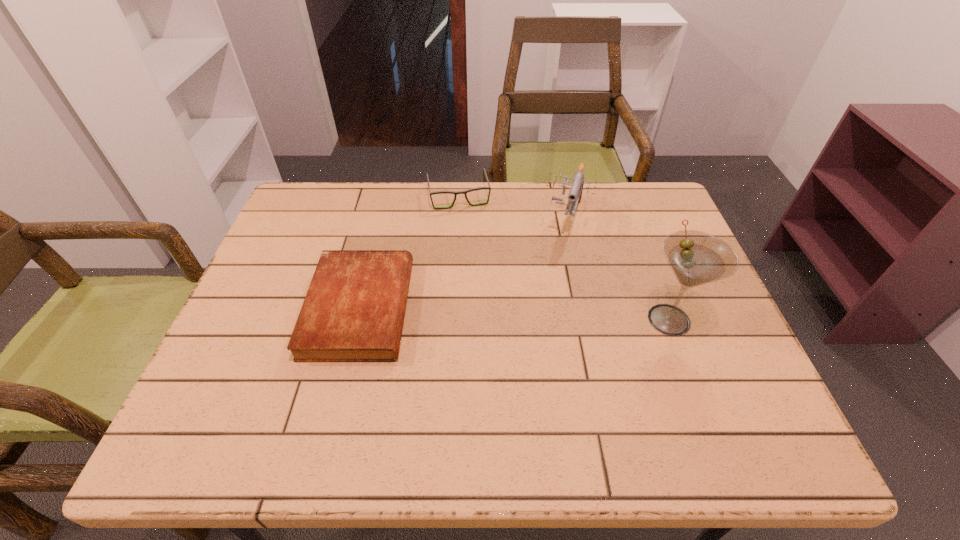
At what (x,y) coordinates should I click in order to perform the action: click on the leftmost object. Please return your answer as a coordinate pair (x, y). This screenshot has height=540, width=960. Looking at the image, I should click on (354, 309).

At what (x,y) coordinates should I click in order to perform the action: click on Bible. Please return your answer as a coordinate pair (x, y). This screenshot has height=540, width=960. Looking at the image, I should click on (354, 309).

In order to click on the rightmost object in this screenshot , I will do `click(696, 258)`.

In order to click on martini in this screenshot , I will do `click(696, 258)`.

I want to click on gun, so click(x=575, y=194).

This screenshot has height=540, width=960. I want to click on the third shortest object, so click(575, 194).

At what (x,y) coordinates should I click in order to perform the action: click on the second object from left to right. Please return your answer as a coordinate pair (x, y). Image resolution: width=960 pixels, height=540 pixels. Looking at the image, I should click on (465, 192).

Where is `spectacles`? spectacles is located at coordinates (465, 192).

Where is `free point located 0.140m on the spine side of the leftmost object`? This screenshot has width=960, height=540. free point located 0.140m on the spine side of the leftmost object is located at coordinates (466, 309).

The height and width of the screenshot is (540, 960). Find the location of `free space located on the back of the tallest object`. free space located on the back of the tallest object is located at coordinates (650, 270).